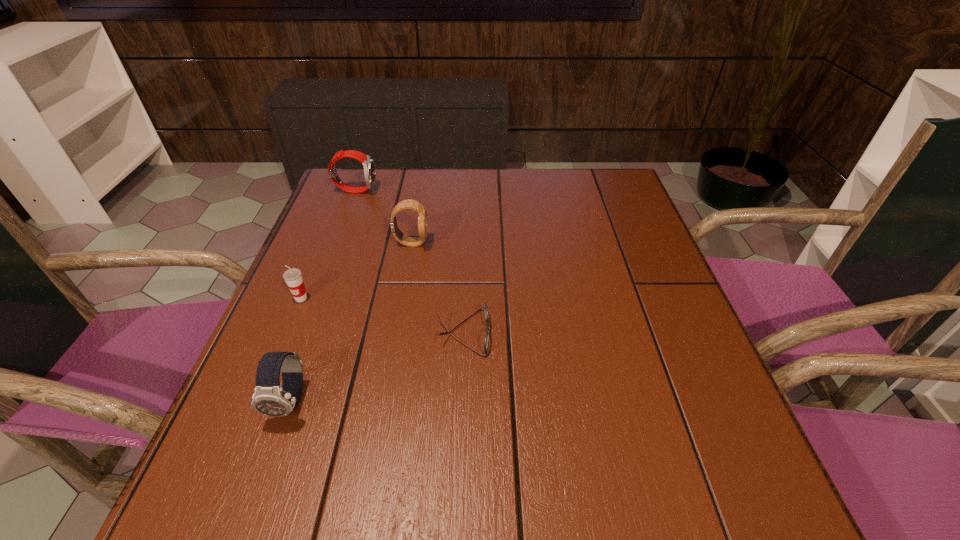
The image size is (960, 540). I want to click on free region at the far left corner of the desktop, so (338, 211).

You are a GUI agent. You are given a task and a screenshot of the screen. Output one action in this format:
    pyautogui.click(x=<x>, y=<y>)
    Task: Click on the vacant space at the near left corner
    
    Given the screenshot: What is the action you would take?
    pyautogui.click(x=279, y=482)

The image size is (960, 540). Find the location of `vacant area at the far right corner`. vacant area at the far right corner is located at coordinates (627, 204).

Find the location of `vacant space at the near right corner of the desktop`. vacant space at the near right corner of the desktop is located at coordinates (657, 477).

The width and height of the screenshot is (960, 540). In order to click on free spot between the second nearest watch and the farthest watch in this screenshot , I will do `click(383, 217)`.

Locate an element on the screen. This screenshot has height=540, width=960. free space between the second object from right to left and the farthest object is located at coordinates (383, 217).

Where is `vacant area that lies between the nearest object and the farthest watch`? vacant area that lies between the nearest object and the farthest watch is located at coordinates (324, 295).

What are the coordinates of `free space between the rightmost object and the cup` in the screenshot? It's located at (382, 315).

Identify the location of vacant region between the farthest object and the rightmost object. (410, 261).

Where is `free spot between the fourth farthest object and the second shortest object`? free spot between the fourth farthest object and the second shortest object is located at coordinates (382, 315).